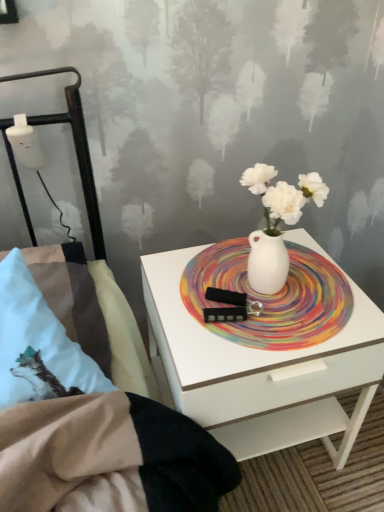
Question: Considering the relative sizes of white glossy nightstand at center and white plastic bottle at left in the image provided, is white glossy nightstand at center taller than white plastic bottle at left?

Choices:
 (A) no
 (B) yes

Answer: (B)

Question: Considering the relative sizes of white glossy nightstand at center and white plastic bottle at left in the image provided, is white glossy nightstand at center smaller than white plastic bottle at left?

Choices:
 (A) no
 (B) yes

Answer: (A)

Question: Does white glossy nightstand at center have a lesser width compared to white plastic bottle at left?

Choices:
 (A) yes
 (B) no

Answer: (B)

Question: Is white glossy nightstand at center positioned with its back to white plastic bottle at left?

Choices:
 (A) yes
 (B) no

Answer: (B)

Question: Is white glossy nightstand at center oriented towards white plastic bottle at left?

Choices:
 (A) no
 (B) yes

Answer: (A)

Question: Is white glossy nightstand at center wider than white plastic bottle at left?

Choices:
 (A) yes
 (B) no

Answer: (A)

Question: Is rainbow painted platter at center far from white glossy nightstand at center?

Choices:
 (A) no
 (B) yes

Answer: (A)

Question: Considering the relative sizes of rainbow painted platter at center and white glossy nightstand at center in the image provided, is rainbow painted platter at center bigger than white glossy nightstand at center?

Choices:
 (A) yes
 (B) no

Answer: (B)

Question: Is rainbow painted platter at center touching white glossy nightstand at center?

Choices:
 (A) no
 (B) yes

Answer: (A)

Question: Considering the relative sizes of rainbow painted platter at center and white glossy nightstand at center in the image provided, is rainbow painted platter at center wider than white glossy nightstand at center?

Choices:
 (A) no
 (B) yes

Answer: (A)

Question: Is rainbow painted platter at center taller than white glossy nightstand at center?

Choices:
 (A) yes
 (B) no

Answer: (B)

Question: Can we say rainbow painted platter at center lies outside white glossy nightstand at center?

Choices:
 (A) yes
 (B) no

Answer: (B)

Question: From a real-world perspective, does white plastic bottle at left sit lower than rainbow painted platter at center?

Choices:
 (A) no
 (B) yes

Answer: (A)